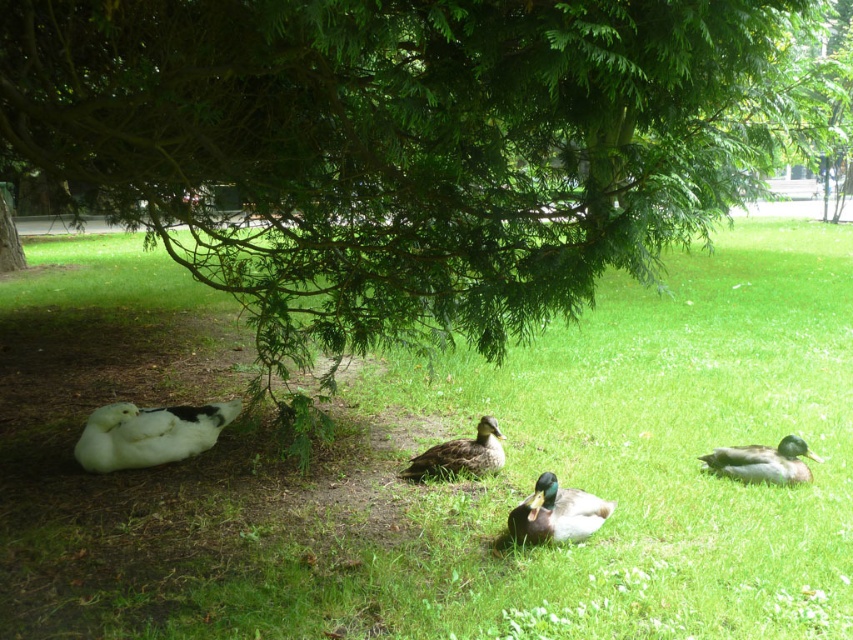
You are a park visitor holding a bag of duck feed. You want to feed the green glossy duck at lower right and the brown matte duck at center without getting too close to them. If the ducks will get scared if you come within 5 feet, can you throw the feed to both ducks from your current position?

The green glossy duck at lower right is 5.43 feet away from the brown matte duck at center. Since the minimum safe distance is 5 feet, you can throw the feed to both ducks as the distance between them is just over 5 feet, allowing you to toss without encroaching the 5 feet boundary.

You are a park visitor carrying a bag of duck food. You see the green glossy duck at lower right and the brown matte duck at center. Which duck is closer to the ground?

The green glossy duck at lower right is closer to the ground because it is located below the brown matte duck at center.